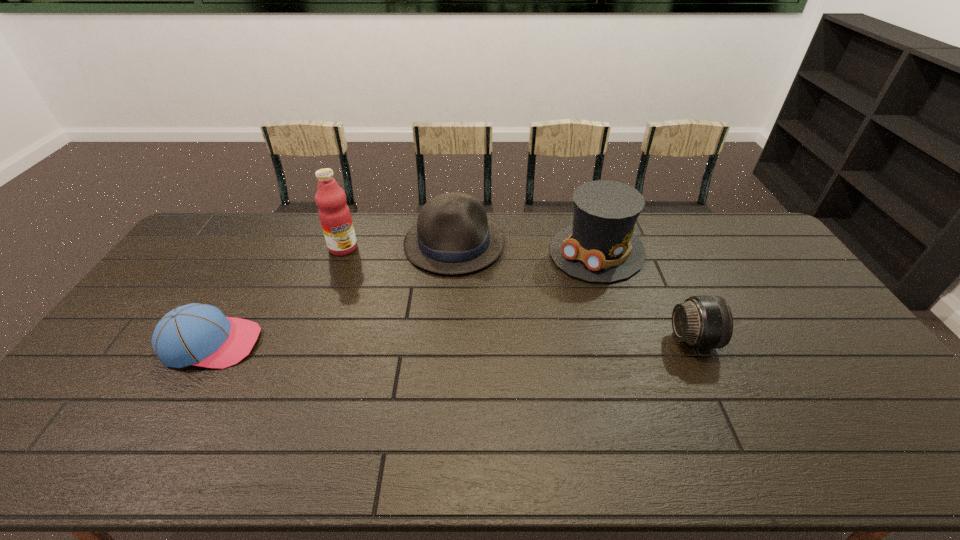
At what (x,y) coordinates should I click in order to perform the action: click on baseball cap. Please return your answer as a coordinate pair (x, y). This screenshot has width=960, height=540. Looking at the image, I should click on (195, 334).

Locate an element on the screen. The width and height of the screenshot is (960, 540). the shortest object is located at coordinates (195, 334).

Find the location of a particular element. The height and width of the screenshot is (540, 960). telephoto lens is located at coordinates (704, 322).

Find the location of a particular element. bowler hat is located at coordinates 452,235.

In order to click on the third object from right to left in this screenshot , I will do `click(452, 235)`.

Where is `the second tallest object`? Image resolution: width=960 pixels, height=540 pixels. the second tallest object is located at coordinates (600, 246).

The height and width of the screenshot is (540, 960). In order to click on the tallest object in this screenshot , I will do `click(334, 214)`.

You are a GUI agent. You are given a task and a screenshot of the screen. Output one action in this format:
    pyautogui.click(x=<x>, y=<y>)
    Task: Click on the second object from left to right
    
    Given the screenshot: What is the action you would take?
    pyautogui.click(x=334, y=214)

Locate an element on the screen. This screenshot has height=540, width=960. blank space located on the front-facing side of the leftmost object is located at coordinates (394, 343).

Locate an element on the screen. This screenshot has width=960, height=540. vacant space located 0.240m on the front-facing side of the telephoto lens is located at coordinates (799, 339).